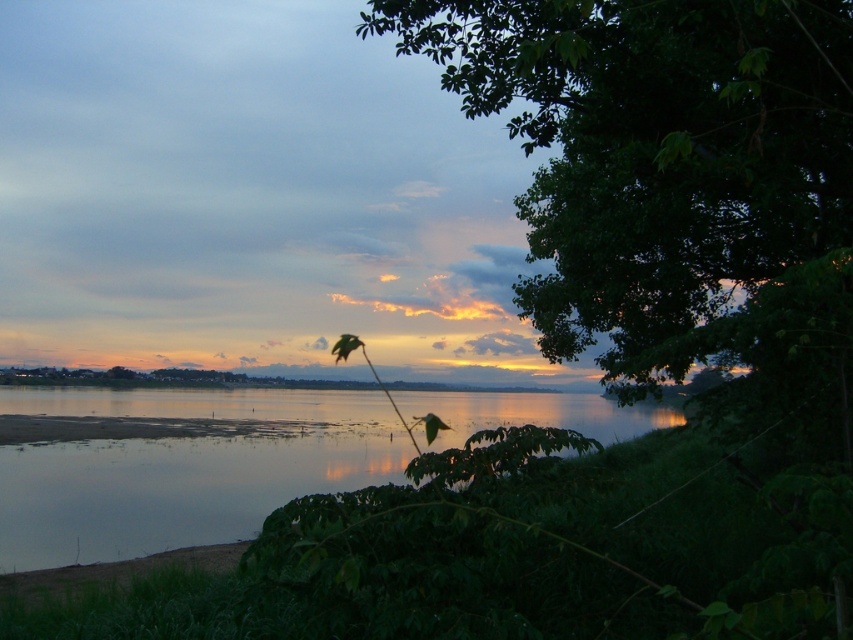
You are an artist trying to paint this riverside scene. You need to decide which object to paint first based on their sizes. Which one should you start with, the green leafy tree at upper right or the silvery reflective water at center?

The green leafy tree at upper right has a larger size compared to the silvery reflective water at center, so you should start painting the green leafy tree at upper right first because it is bigger.

You are standing at the riverside and want to take a photo of both the green leafy tree at upper right and the silvery reflective water at center. Which object should you focus on first to ensure both are in clear view?

You should focus on the green leafy tree at upper right first because it is closer to you than the silvery reflective water at center. By focusing on the closer object, both will be in clear view due to the overlapping depth of field.

You are an artist trying to sketch this riverside scene. You want to ensure the green leafy tree at upper right and the silvery reflective water at center are proportionally accurate. Which object should you draw with a narrower width?

The green leafy tree at upper right should be drawn with a narrower width because it is thinner than the silvery reflective water at center according to the description.